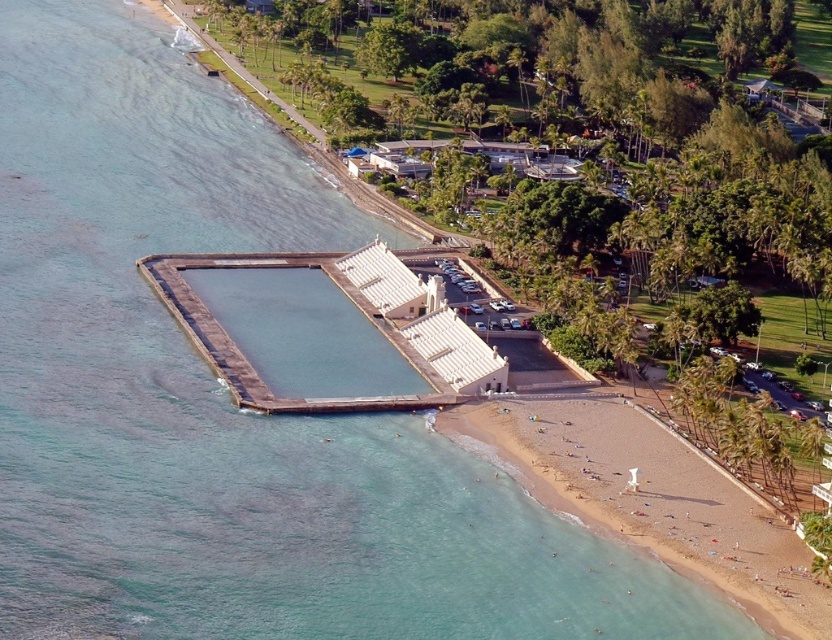
Question: Which point appears farthest from the camera in this image?

Choices:
 (A) (622, 403)
 (B) (147, 278)

Answer: (B)

Question: Does beige sand beach at lower right appear under smooth concrete dock at lower center?

Choices:
 (A) no
 (B) yes

Answer: (B)

Question: Is beige sand beach at lower right above smooth concrete dock at lower center?

Choices:
 (A) yes
 (B) no

Answer: (B)

Question: Which object appears farthest from the camera in this image?

Choices:
 (A) beige sand beach at lower right
 (B) smooth concrete dock at lower center

Answer: (B)

Question: Which point is closer to the camera?

Choices:
 (A) beige sand beach at lower right
 (B) smooth concrete dock at lower center

Answer: (A)

Question: Does beige sand beach at lower right appear under smooth concrete dock at lower center?

Choices:
 (A) yes
 (B) no

Answer: (A)